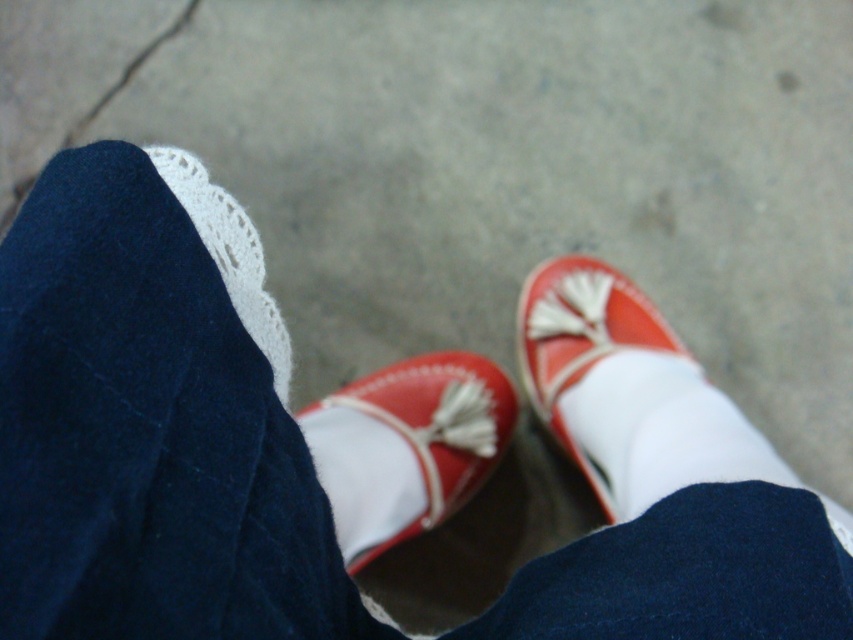
Question: Among these points, which one is nearest to the camera?

Choices:
 (A) (579, 304)
 (B) (393, 493)
 (C) (236, 273)

Answer: (C)

Question: Observing the image, what is the correct spatial positioning of matte leather shoe at lower right in reference to white lace at upper left?

Choices:
 (A) left
 (B) right

Answer: (B)

Question: Which point appears farthest from the camera in this image?

Choices:
 (A) (573, 401)
 (B) (317, 426)
 (C) (215, 200)

Answer: (A)

Question: Can you confirm if white smooth sock at lower right is positioned below white lace at upper left?

Choices:
 (A) yes
 (B) no

Answer: (A)

Question: Which object is closer to the camera taking this photo?

Choices:
 (A) red leather shoe at center
 (B) white lace at upper left

Answer: (B)

Question: Does white smooth sock at lower right have a larger size compared to white lace at upper left?

Choices:
 (A) yes
 (B) no

Answer: (A)